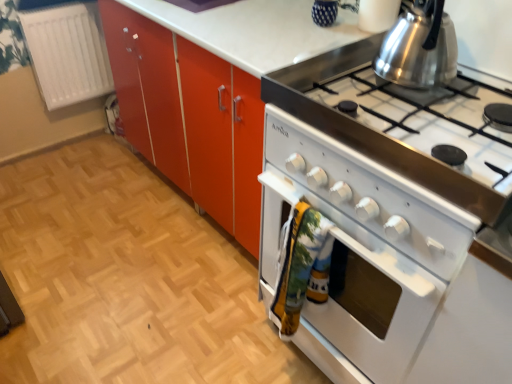
This screenshot has width=512, height=384. Find the location of `free space above white plastic radiator at left (from a real-world perspective)`. free space above white plastic radiator at left (from a real-world perspective) is located at coordinates (57, 5).